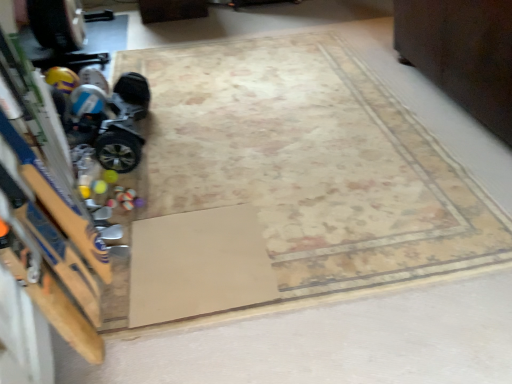
Locate an element on the screen. Image resolution: width=512 pixels, height=384 pixels. free space to the back side of shiny metallic hoverboard at left is located at coordinates (174, 97).